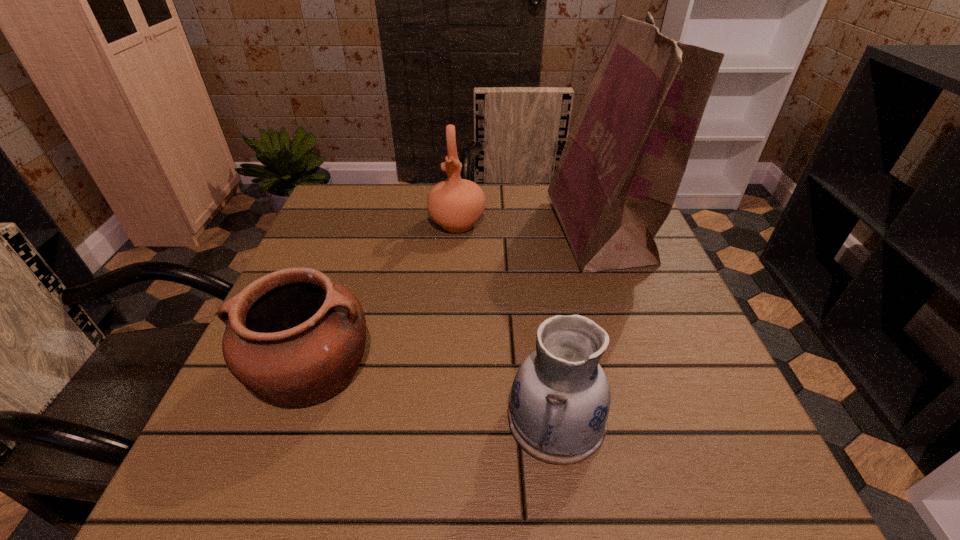
You are a GUI agent. You are given a task and a screenshot of the screen. Output one action in this format:
    pyautogui.click(x=<x>, y=<y>)
    Task: Click on the grocery bag
    This screenshot has width=960, height=540.
    Given the screenshot: What is the action you would take?
    pyautogui.click(x=617, y=178)

Locate an element on the screen. the second object from left to right is located at coordinates (456, 204).

Find the location of a particular element. the farthest pottery is located at coordinates (456, 204).

Where is `the rightmost pottery`? The width and height of the screenshot is (960, 540). the rightmost pottery is located at coordinates (560, 399).

The image size is (960, 540). Find the location of `the second shortest pottery`. the second shortest pottery is located at coordinates click(x=560, y=399).

Where is `the shortest object`? the shortest object is located at coordinates (294, 337).

This screenshot has width=960, height=540. I want to click on the leftmost pottery, so click(x=294, y=337).

This screenshot has height=540, width=960. Find the location of `vacant position located 0.250m on the front-facing side of the grocery bag`. vacant position located 0.250m on the front-facing side of the grocery bag is located at coordinates (450, 232).

The image size is (960, 540). Identify the location of vacant area situated on the front-facing side of the grocery bag. click(x=508, y=232).

Image resolution: width=960 pixels, height=540 pixels. Identify the location of free location located 0.140m on the front-facing side of the grocery bag. (495, 232).